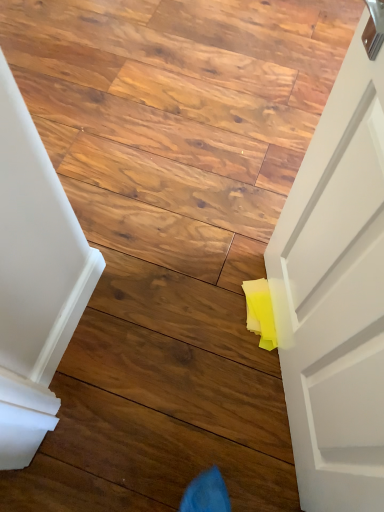
Locate an element on the screen. This screenshot has width=384, height=512. vacant region above yellow paper at lower right (from a real-world perspective) is located at coordinates (172, 152).